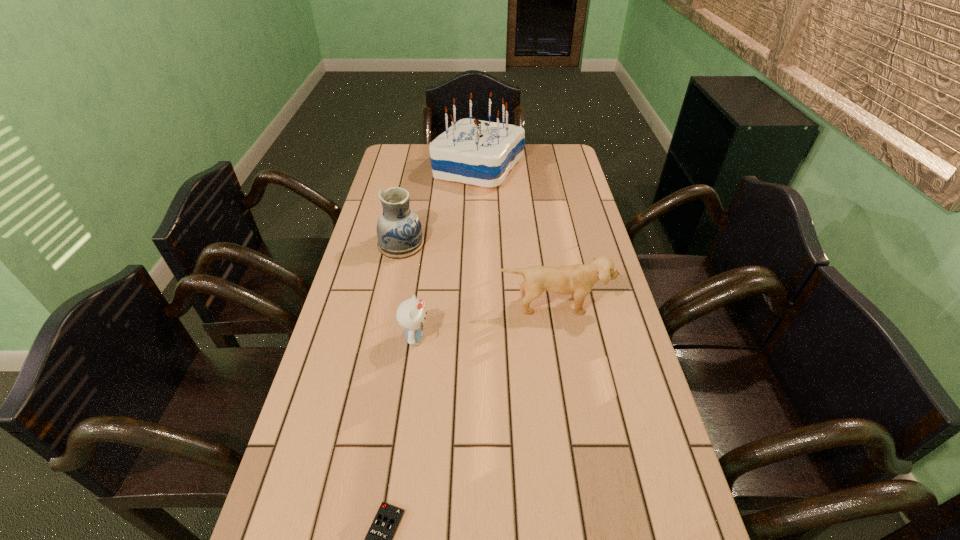
The height and width of the screenshot is (540, 960). I want to click on the farthest object, so coord(482,153).

You are a GUI agent. You are given a task and a screenshot of the screen. Output one action in this format:
    pyautogui.click(x=<x>, y=<y>)
    Task: Click on the tallest object
    This screenshot has width=960, height=540.
    Given the screenshot: What is the action you would take?
    pyautogui.click(x=482, y=153)

This screenshot has width=960, height=540. What are the coordinates of `the second farthest object` in the screenshot? It's located at (399, 231).

You are a GUI agent. You are given a task and a screenshot of the screen. Output one action in this format:
    pyautogui.click(x=<x>, y=<y>)
    Task: Click on the third nearest object
    
    Given the screenshot: What is the action you would take?
    pyautogui.click(x=578, y=279)

This screenshot has height=540, width=960. I want to click on the third tallest object, so click(x=578, y=279).

This screenshot has width=960, height=540. I want to click on the fourth farthest object, so click(x=410, y=314).

This screenshot has width=960, height=540. What are the coordinates of `kitten` in the screenshot? It's located at (410, 314).

Locate an element on the screen. The width and height of the screenshot is (960, 540). vacant point located 0.180m on the left of the farthest object is located at coordinates (385, 168).

The image size is (960, 540). In order to click on blank space located 0.080m on the right of the pottery in this screenshot , I will do `click(450, 244)`.

The width and height of the screenshot is (960, 540). What are the coordinates of `free spot located on the left side of the puppy` in the screenshot? It's located at (572, 416).